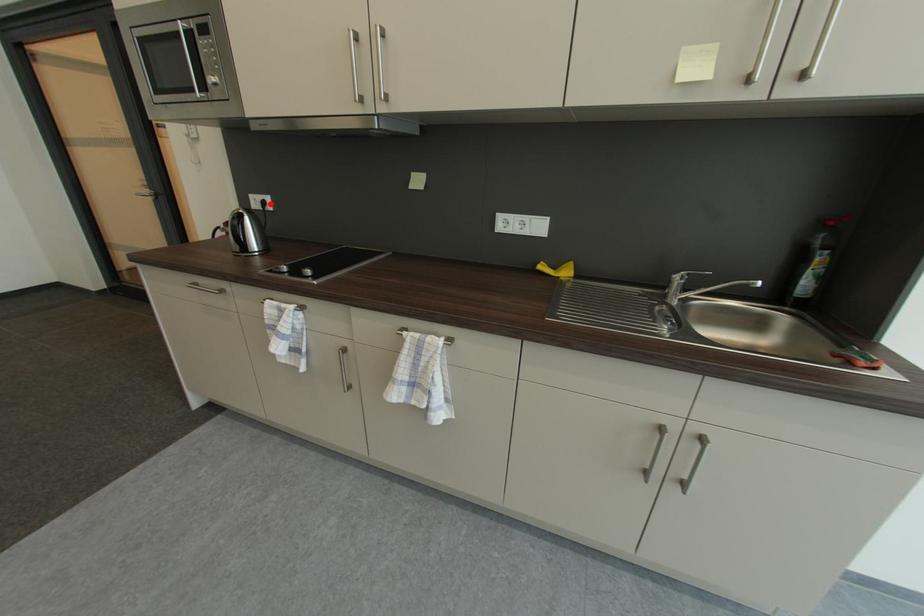
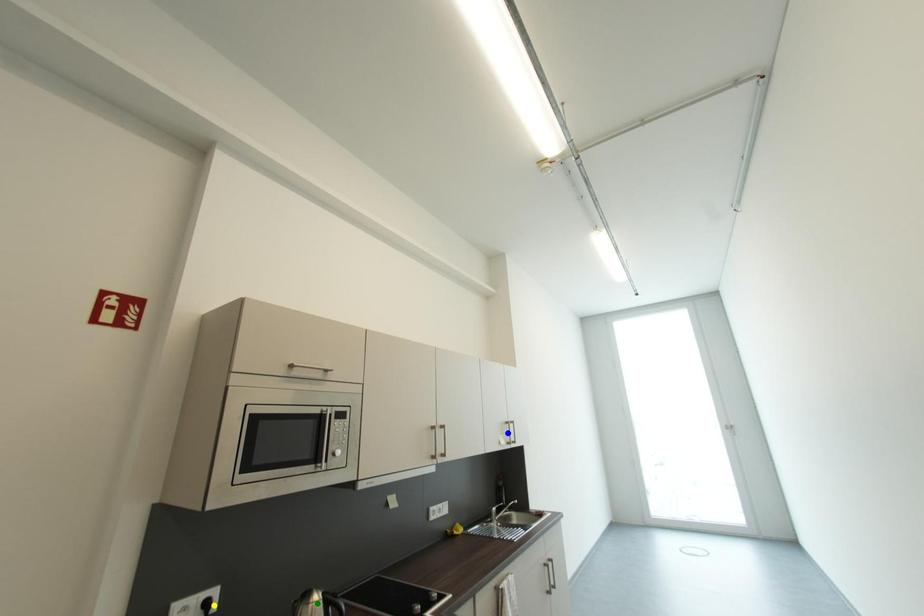
Question: I am providing you with two images of the same scene from different viewpoints. A red point is marked on the first image. You are given multiple points on the second image. Which point in image 2 is actually the same real-world point as the red point in image 1?

Choices:
 (A) yellow point
 (B) blue point
 (C) green point

Answer: (A)